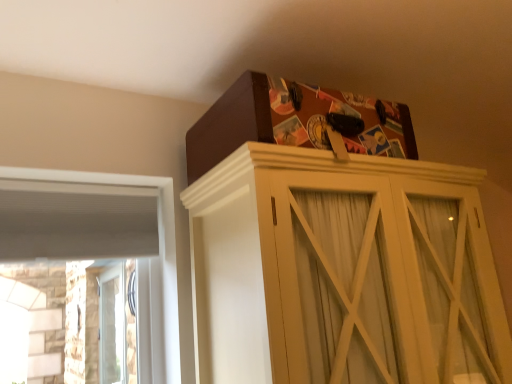
Question: Can you confirm if brown cardboard box at upper center is positioned to the right of matte brown cabinet at upper center?

Choices:
 (A) yes
 (B) no

Answer: (B)

Question: Does brown cardboard box at upper center have a greater height compared to matte brown cabinet at upper center?

Choices:
 (A) yes
 (B) no

Answer: (B)

Question: Is brown cardboard box at upper center to the left of matte brown cabinet at upper center from the viewer's perspective?

Choices:
 (A) no
 (B) yes

Answer: (B)

Question: Is brown cardboard box at upper center positioned with its back to matte brown cabinet at upper center?

Choices:
 (A) yes
 (B) no

Answer: (B)

Question: Does brown cardboard box at upper center have a lesser height compared to matte brown cabinet at upper center?

Choices:
 (A) no
 (B) yes

Answer: (B)

Question: Does brown cardboard box at upper center have a greater width compared to matte brown cabinet at upper center?

Choices:
 (A) no
 (B) yes

Answer: (A)

Question: Can you confirm if matte brown cabinet at upper center is positioned to the right of white wood frame at left?

Choices:
 (A) no
 (B) yes

Answer: (B)

Question: From the image's perspective, is matte brown cabinet at upper center above white wood frame at left?

Choices:
 (A) yes
 (B) no

Answer: (A)

Question: Is matte brown cabinet at upper center in front of white wood frame at left?

Choices:
 (A) yes
 (B) no

Answer: (A)

Question: Are matte brown cabinet at upper center and white wood frame at left making contact?

Choices:
 (A) no
 (B) yes

Answer: (A)

Question: Is matte brown cabinet at upper center to the left of white wood frame at left from the viewer's perspective?

Choices:
 (A) yes
 (B) no

Answer: (B)

Question: Is white wood frame at left located within matte brown cabinet at upper center?

Choices:
 (A) no
 (B) yes

Answer: (A)

Question: Is matte brown cabinet at upper center bigger than brown cardboard box at upper center?

Choices:
 (A) yes
 (B) no

Answer: (A)